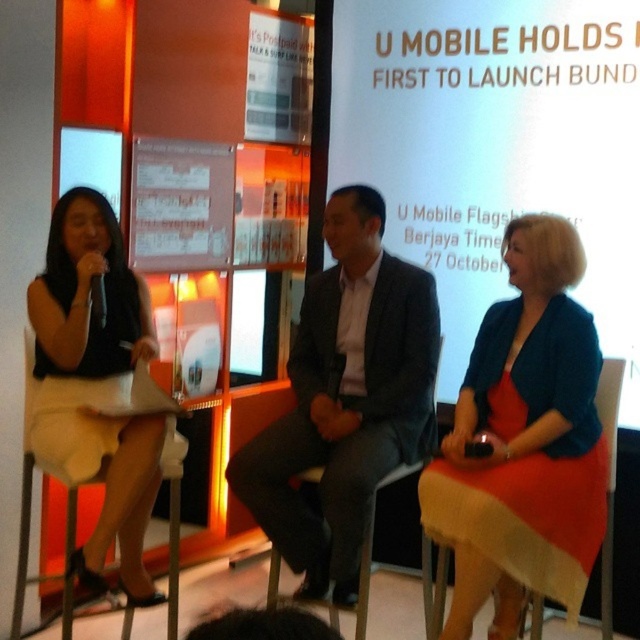
You are an event organizer trying to adjust the seating arrangement. You need to place a name tag on the podium. Which of the following should you place the name tag under based on their current positions? The options are the matte blue dress at center and the dark gray suit at center.

The matte blue dress at center is positioned under the dark gray suit at center, so you should place the name tag under the dark gray suit at center.